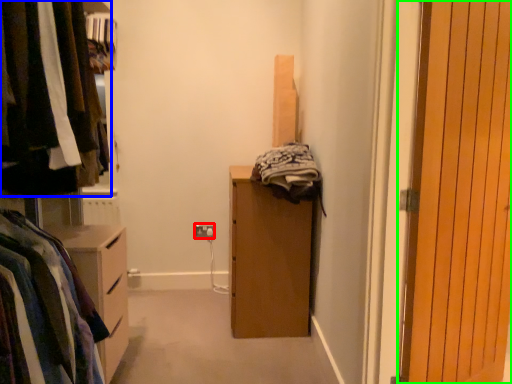
Question: Based on their relative distances, which object is nearer to electric outlet (highlighted by a red box)? Choose from closet (highlighted by a blue box) and door (highlighted by a green box).

Choices:
 (A) closet
 (B) door

Answer: (A)